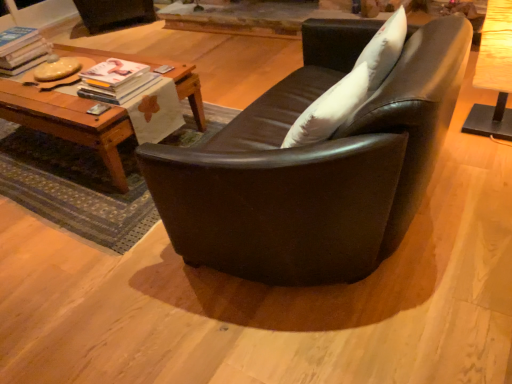
Identify the location of blank space to the left of wooden table at right, acting as the 1th table starting from the right. The image size is (512, 384). (458, 143).